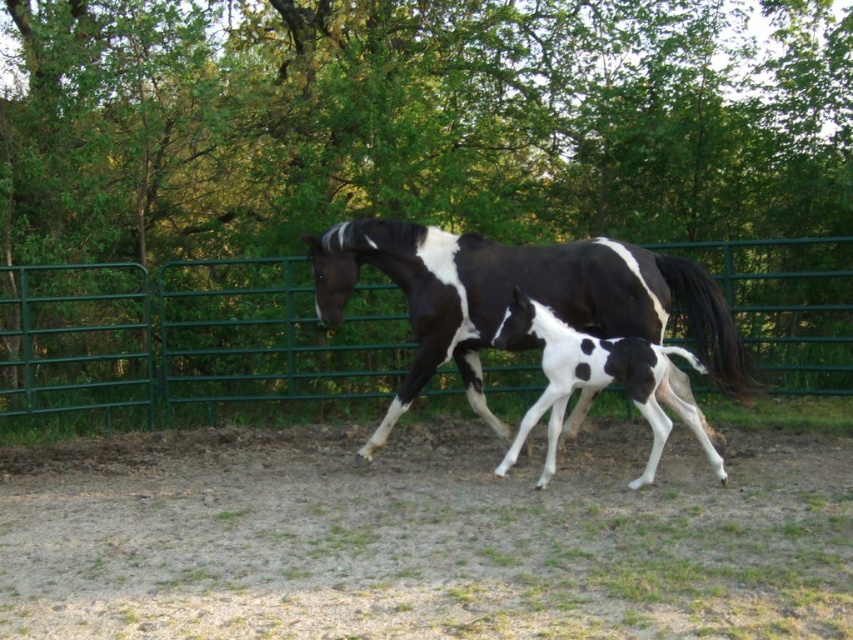
Which is behind, point (331, 310) or point (701, 440)?

The point (331, 310) is more distant.

Does black and white speckled horse at center have a lesser width compared to white-spotted glossy horse at center?

In fact, black and white speckled horse at center might be wider than white-spotted glossy horse at center.

Is point (682, 392) closer to viewer compared to point (666, 397)?

No, it is not.

The image size is (853, 640). Find the location of `black and white speckled horse at center`. black and white speckled horse at center is located at coordinates (525, 292).

Can you confirm if green metal fence at center is positioned to the right of black and white speckled horse at center?

No, green metal fence at center is not to the right of black and white speckled horse at center.

Describe the element at coordinates (186, 337) in the screenshot. I see `green metal fence at center` at that location.

At what (x,y) coordinates should I click in order to perform the action: click on green metal fence at center. Please return your answer as a coordinate pair (x, y). This screenshot has height=640, width=853. Looking at the image, I should click on (186, 337).

Where is `green metal fence at center`? green metal fence at center is located at coordinates (186, 337).

The width and height of the screenshot is (853, 640). Describe the element at coordinates (186, 337) in the screenshot. I see `green metal fence at center` at that location.

Does point (10, 408) come closer to viewer compared to point (604, 344)?

No.

This screenshot has height=640, width=853. I want to click on green metal fence at center, so click(x=186, y=337).